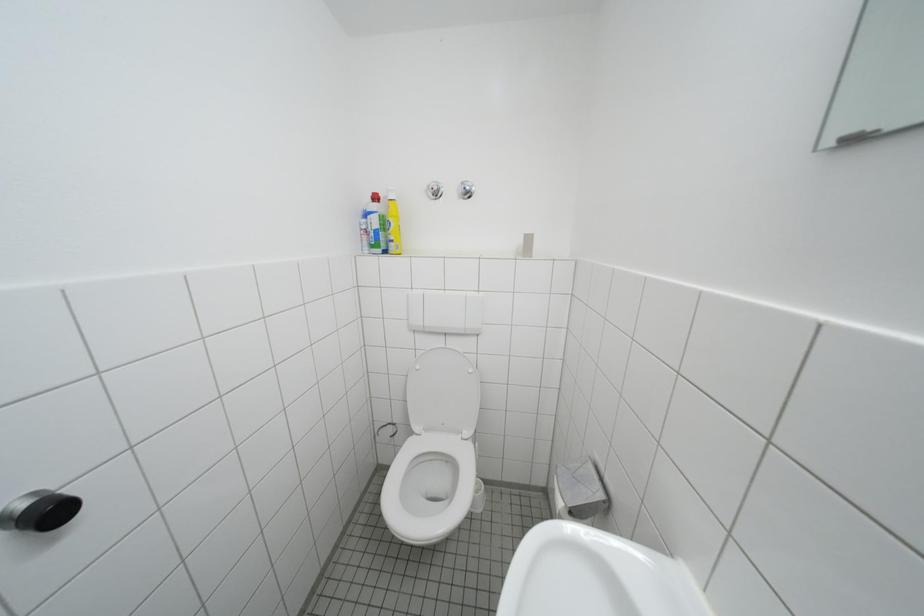
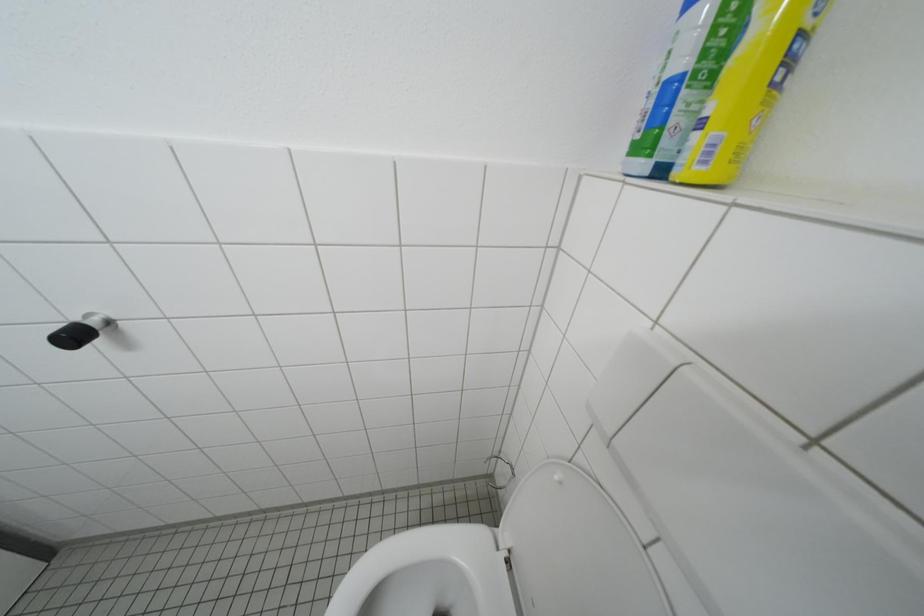
Looking at this image, how did the camera likely rotate?

The camera rotated toward left-down.